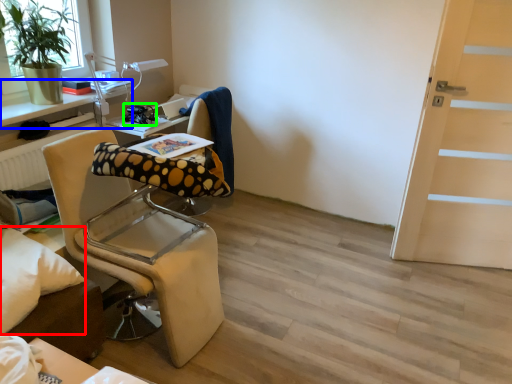
Question: Considering the real-world distances, which object is closest to pillow (highlighted by a red box)? table (highlighted by a blue box) or equipment (highlighted by a green box).

Choices:
 (A) table
 (B) equipment

Answer: (A)